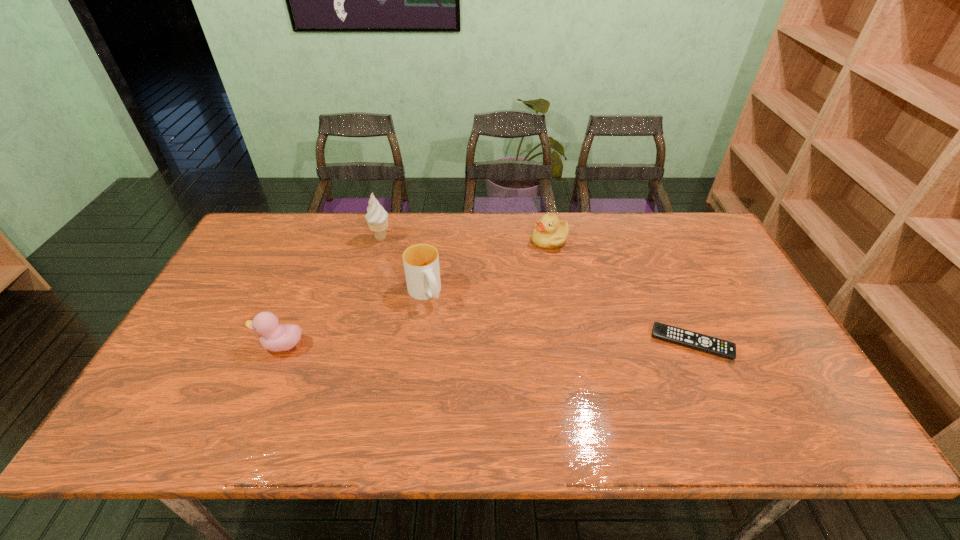
The height and width of the screenshot is (540, 960). I want to click on free space between the leftmost object and the rightmost object, so click(x=486, y=344).

Identify which object is located as the second nearest to the leftmost object. Please provide its 2D coordinates. Your answer should be formatted as a tuple, i.e. [(x, y)], where the tuple contains the x and y coordinates of a point satisfying the conditions above.

[(377, 218)]

In order to click on the fourth closest object relative to the remote control in this screenshot , I will do `click(275, 337)`.

At what (x,y) coordinates should I click in order to perform the action: click on free space that satisfies the following two spatial constraints: 1. on the front side of the icecream; 2. on the right side of the second object from right to left. Please return your answer as a coordinate pair (x, y). Looking at the image, I should click on (380, 240).

Find the location of a particular element. free location that satisfies the following two spatial constraints: 1. on the front side of the third farthest object; 2. on the left side of the rightmost object is located at coordinates (418, 343).